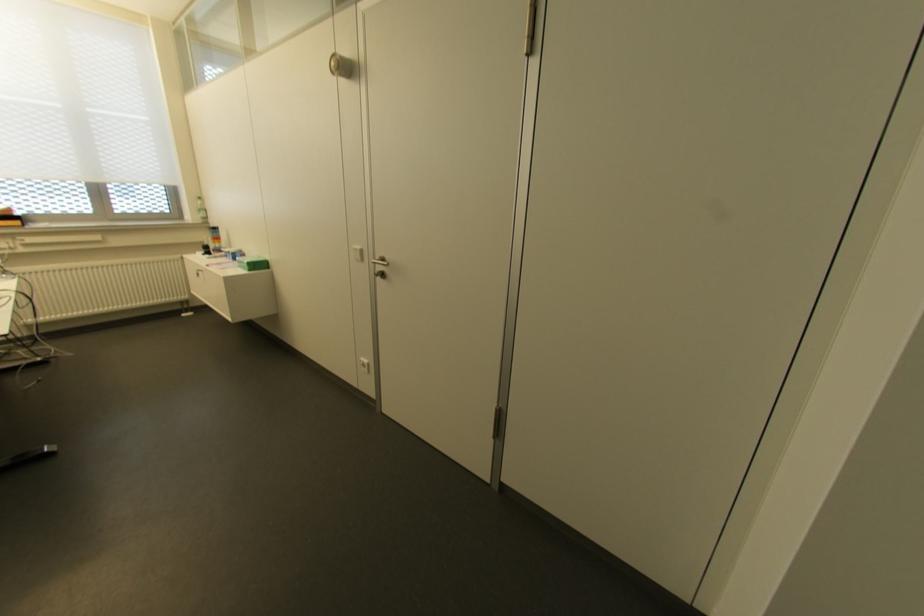
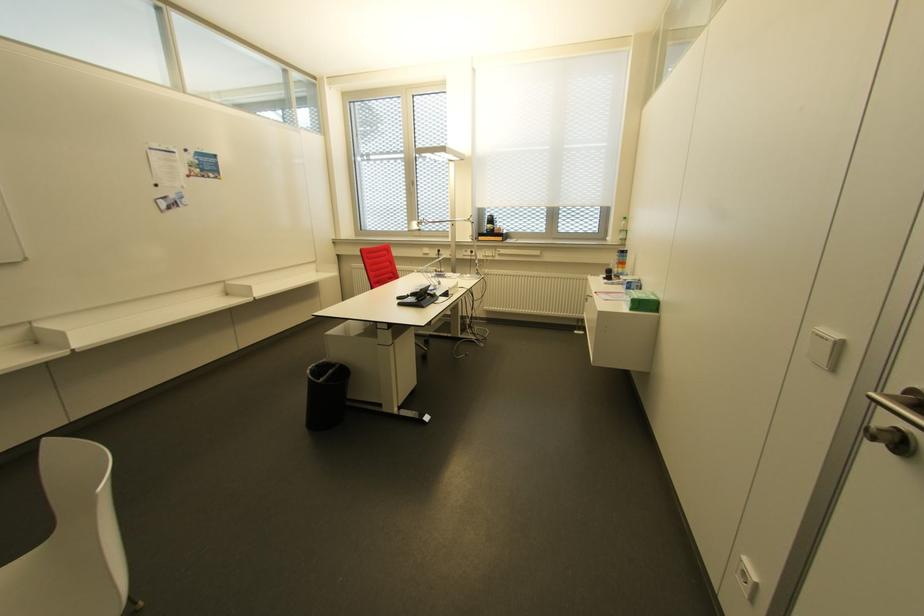
Where in the second image is the point corresponding to point 248,270 from the first image?

(629, 310)